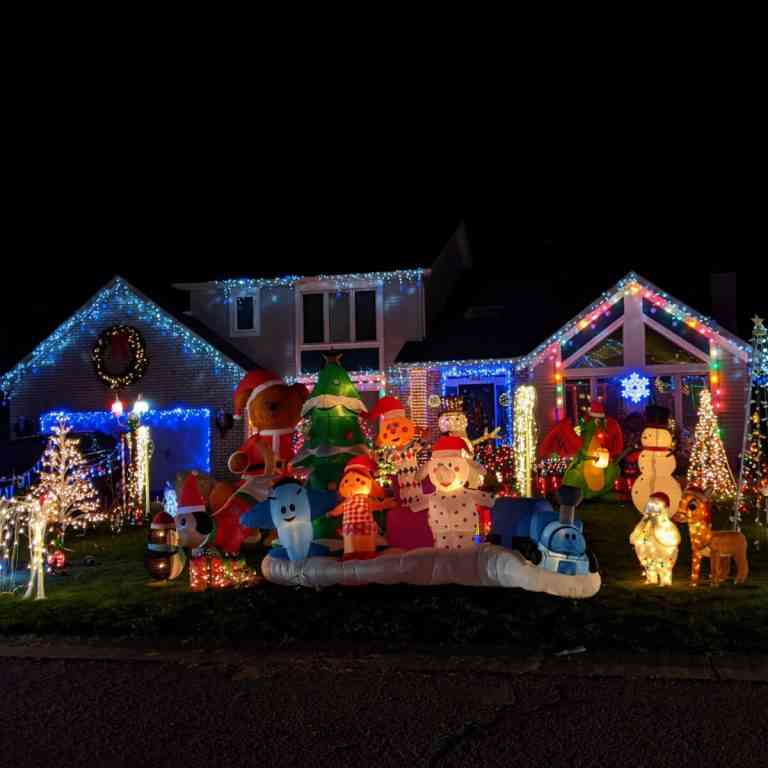
At what (x,y) coordinates should I click in order to perform the action: click on christmas lights. Please return your answer as a coordinate pair (x, y). This screenshot has height=768, width=768. Looking at the image, I should click on (147, 318).